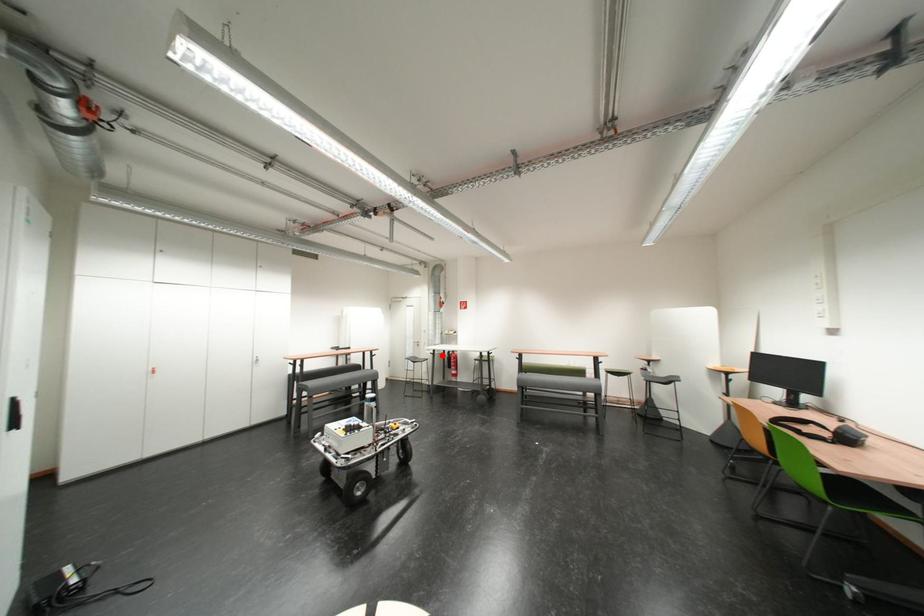
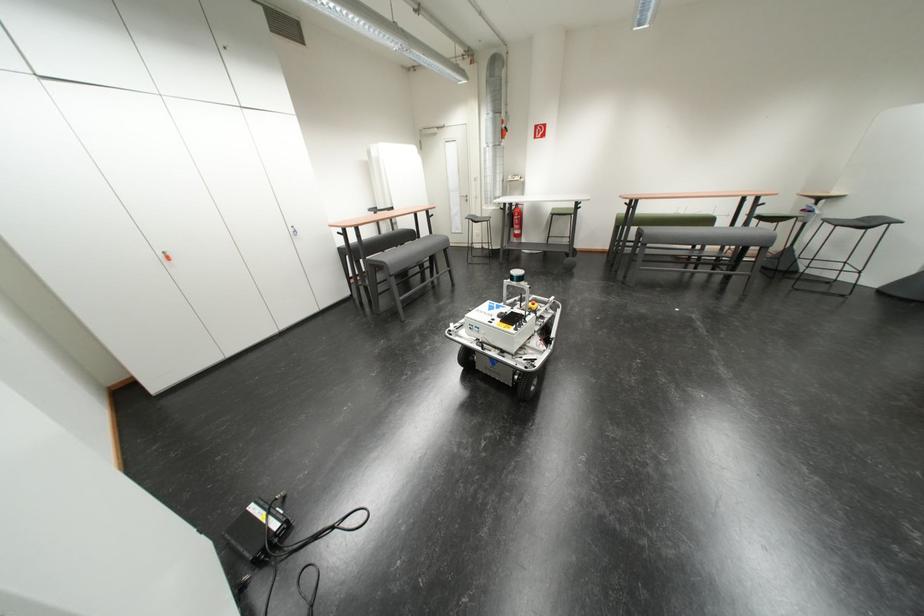
Question: I am providing you with two images of the same scene from different viewpoints. A red point is shown in image1. For the corresponding object point in image2, is it positioned nearer or farther from the camera?

Choices:
 (A) Nearer
 (B) Farther

Answer: (A)